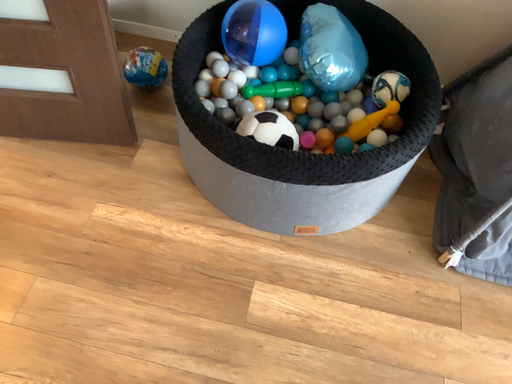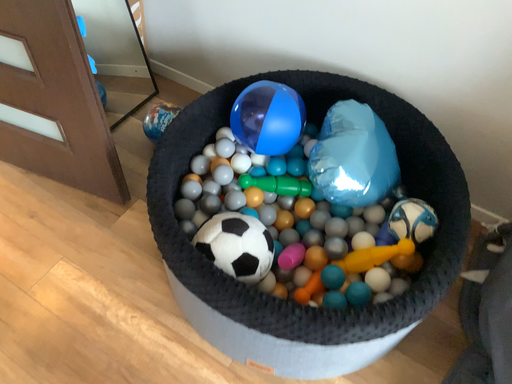
Question: Which way did the camera rotate in the video?

Choices:
 (A) rotated right
 (B) rotated left

Answer: (B)